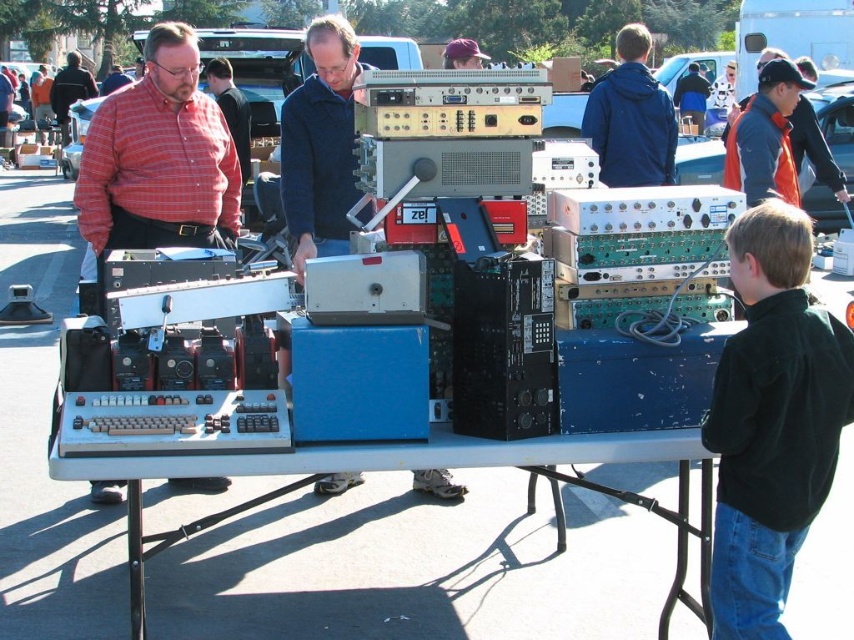
Is black cotton shirt at lower right to the right of matte red shirt at upper left from the viewer's perspective?

Yes, black cotton shirt at lower right is to the right of matte red shirt at upper left.

Does black cotton shirt at lower right have a greater height compared to matte red shirt at upper left?

Indeed, black cotton shirt at lower right has a greater height compared to matte red shirt at upper left.

Locate an element on the screen. black cotton shirt at lower right is located at coordinates point(771,420).

Who is higher up, red plaid shirt at left or matte red shirt at upper left?

matte red shirt at upper left

Who is taller, red plaid shirt at left or matte red shirt at upper left?

red plaid shirt at left

This screenshot has width=854, height=640. In order to click on red plaid shirt at left in this screenshot , I will do coord(159,157).

Which is above, black cotton shirt at lower right or red plaid shirt at left?

red plaid shirt at left is above.

Who is positioned more to the right, black cotton shirt at lower right or red plaid shirt at left?

black cotton shirt at lower right

Describe the element at coordinates (771, 420) in the screenshot. I see `black cotton shirt at lower right` at that location.

Find the location of `black cotton shirt at lower right`. black cotton shirt at lower right is located at coordinates (771, 420).